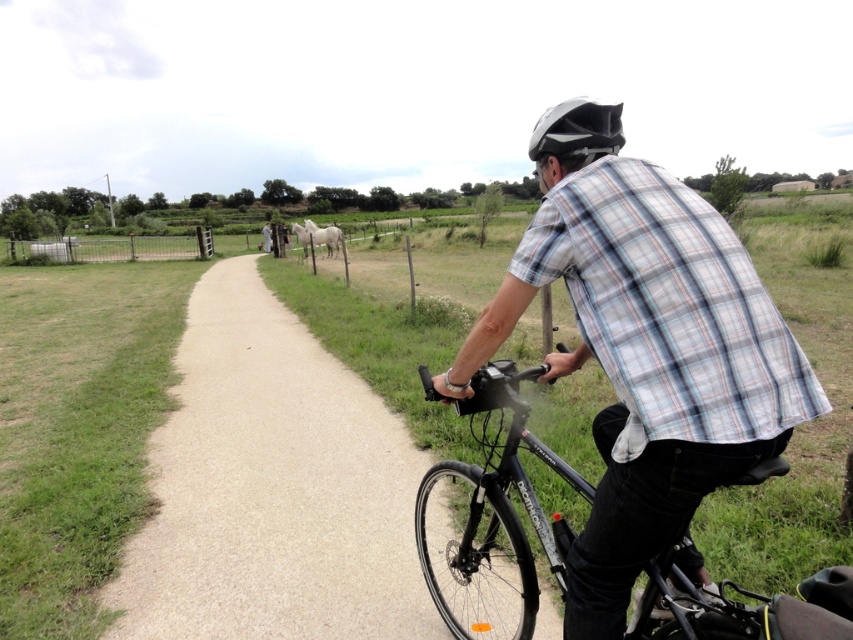
You are a cyclist planning to ride along the paved road at center. You notice the black matte bicycle at center is parked on the path. Can you safely pass it on the left side?

The paved road at center is to the left of black matte bicycle at center, so you can safely pass the black matte bicycle at center on the left side since there is space available on the paved road at center.

You are a delivery person who needs to park your black matte bicycle at center near the metallic wire fence at left. Considering their sizes, will the bicycle fit in the space between the fence and the road?

The black matte bicycle at center occupies less space than the metallic wire fence at left, so it should fit in the space between the fence and the road.